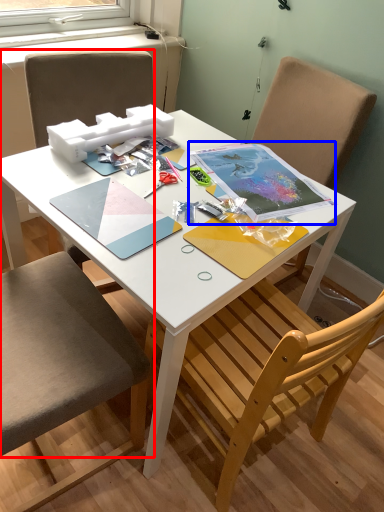
Question: Which object appears closest to the camera in this image, chair (highlighted by a red box) or notebook (highlighted by a blue box)?

Choices:
 (A) chair
 (B) notebook

Answer: (A)